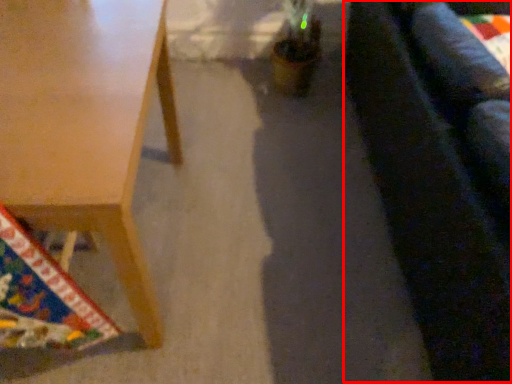
Question: From the image's perspective, considering the relative positions of couch (annotated by the red box) and table in the image provided, where is couch (annotated by the red box) located with respect to the staircase?

Choices:
 (A) above
 (B) below

Answer: (A)